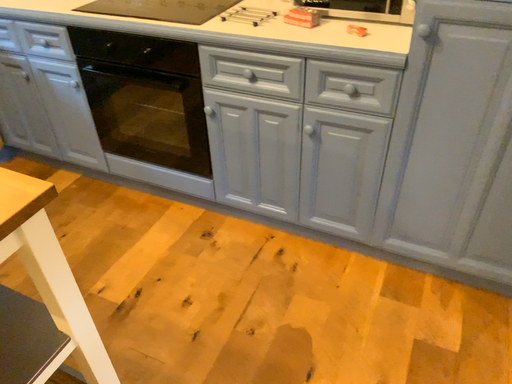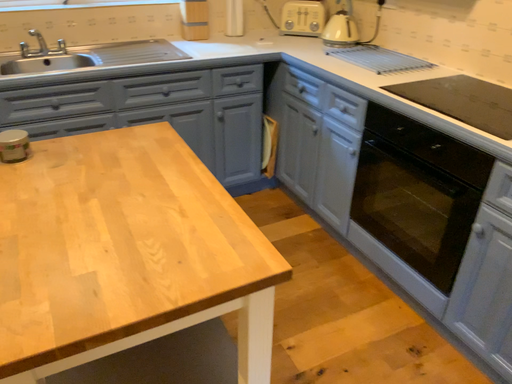
Question: How did the camera likely rotate when shooting the video?

Choices:
 (A) rotated left
 (B) rotated right

Answer: (A)